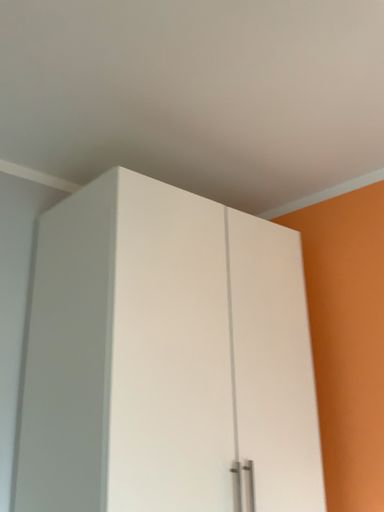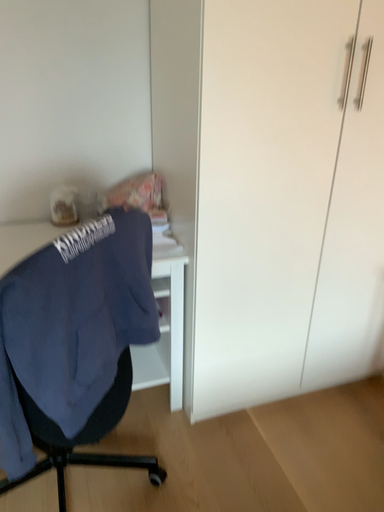
Question: How did the camera likely rotate when shooting the video?

Choices:
 (A) rotated right
 (B) rotated left

Answer: (B)